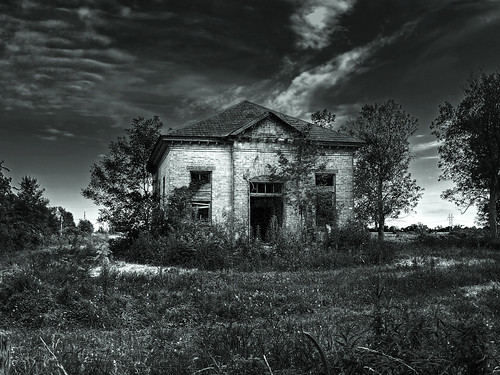
Find the location of `arch over entryway`. arch over entryway is located at coordinates point(266,171).